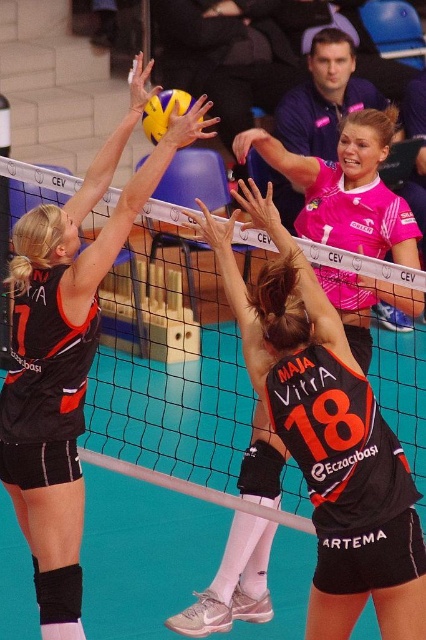
Question: Does black mesh net at center appear on the right side of yellow matte volleyball at upper center?

Choices:
 (A) no
 (B) yes

Answer: (B)

Question: Which object appears closest to the camera in this image?

Choices:
 (A) yellow matte volleyball at upper center
 (B) black matte jersey at left
 (C) black mesh net at center
 (D) pink jersey at upper center

Answer: (B)

Question: Does black mesh net at center come behind pink jersey at upper center?

Choices:
 (A) yes
 (B) no

Answer: (A)

Question: Considering the relative positions of pink jersey at upper center and yellow matte volleyball at upper center in the image provided, where is pink jersey at upper center located with respect to yellow matte volleyball at upper center?

Choices:
 (A) right
 (B) left

Answer: (A)

Question: Which of the following is the farthest from the observer?

Choices:
 (A) 155,371
 (B) 175,93
 (C) 402,260

Answer: (B)

Question: Which is farther from the black matte jersey at left?

Choices:
 (A) yellow matte volleyball at upper center
 (B) pink jersey at upper center
 (C) black mesh net at center

Answer: (A)